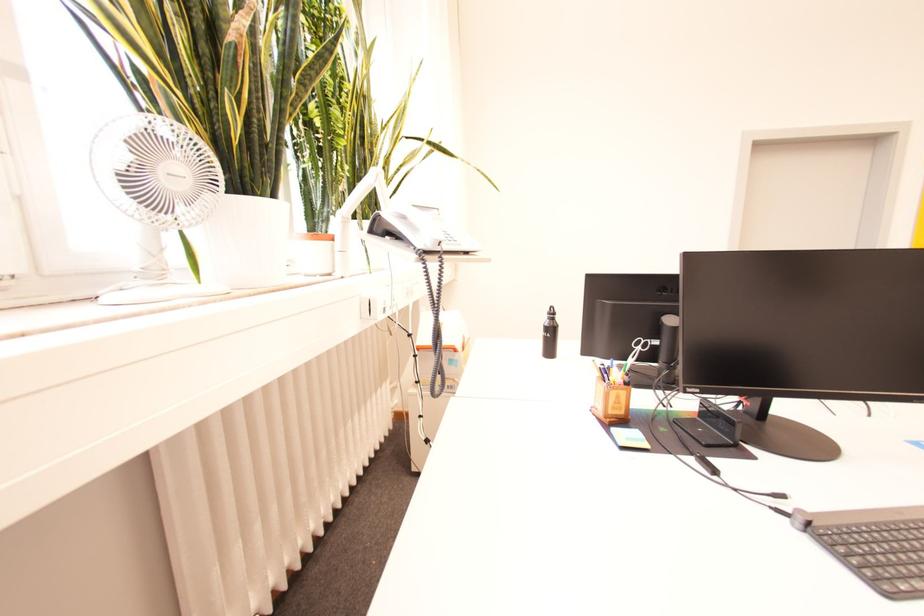
Find the location of a particular element. wooden pen holder is located at coordinates (611, 398).